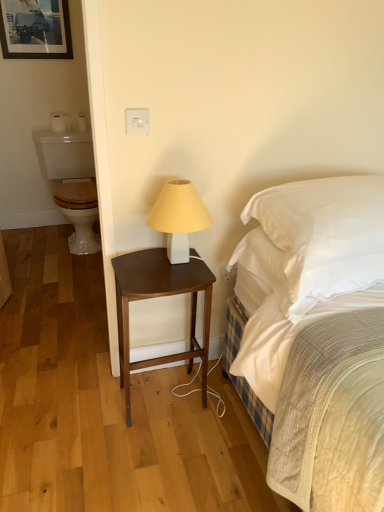
At what (x,y) coordinates should I click in order to perform the action: click on free area below dark wood nightstand at center (from a real-world perspective). Please return your answer as a coordinate pair (x, y). Image resolution: width=384 pixels, height=512 pixels. Looking at the image, I should click on (169, 398).